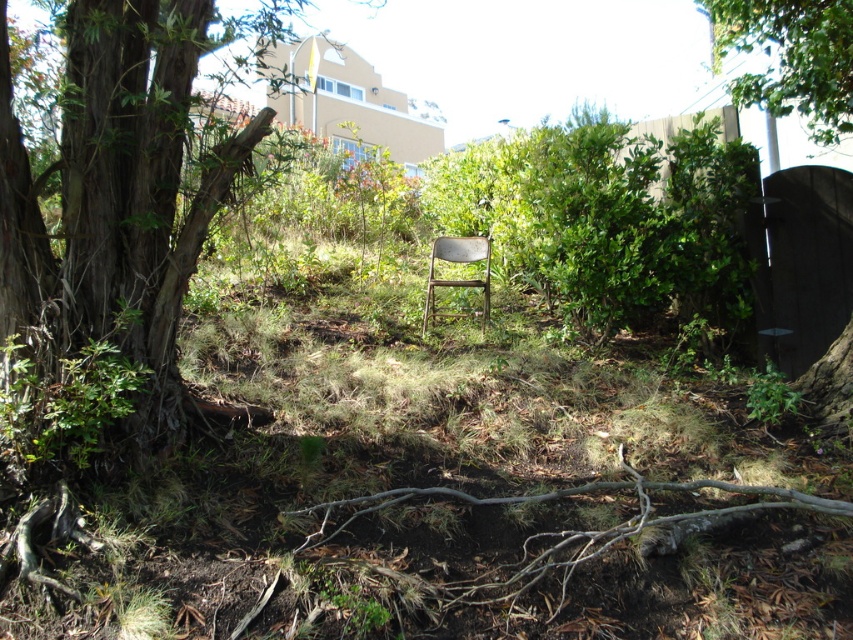
Question: Can you confirm if green leafy tree at left is positioned below metallic folding chair at center?

Choices:
 (A) no
 (B) yes

Answer: (A)

Question: Can you confirm if green leafy bush at center is positioned to the right of green leafy tree at upper right?

Choices:
 (A) no
 (B) yes

Answer: (A)

Question: Which object is closer to the camera taking this photo?

Choices:
 (A) green leafy tree at upper right
 (B) metallic folding chair at center
 (C) green leafy tree at left
 (D) green leafy bush at center

Answer: (C)

Question: Which object appears closest to the camera in this image?

Choices:
 (A) green leafy tree at upper right
 (B) green leafy tree at left
 (C) green leafy bush at center
 (D) metallic folding chair at center

Answer: (B)

Question: Which object appears closest to the camera in this image?

Choices:
 (A) metallic folding chair at center
 (B) green leafy bush at center

Answer: (B)

Question: Considering the relative positions of green leafy bush at center and green leafy tree at upper right in the image provided, where is green leafy bush at center located with respect to green leafy tree at upper right?

Choices:
 (A) right
 (B) left

Answer: (B)